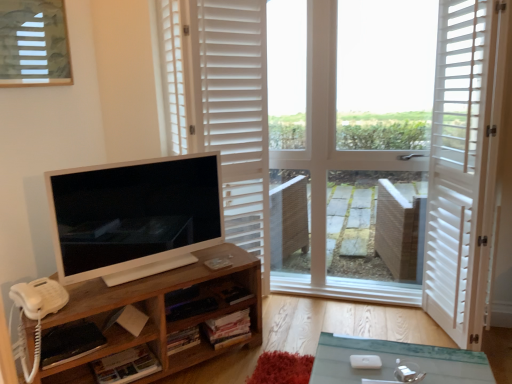
This screenshot has width=512, height=384. Describe the element at coordinates (135, 216) in the screenshot. I see `satin white monitor at left` at that location.

This screenshot has height=384, width=512. Describe the element at coordinates (456, 162) in the screenshot. I see `white wooden screen door at right` at that location.

Find the location of a particular element. The image size is (512, 384). satin white monitor at left is located at coordinates (135, 216).

Do you think satin white monitor at left is within matte glass window at upper left, or outside of it?

satin white monitor at left is located beyond the bounds of matte glass window at upper left.

In terms of height, does satin white monitor at left look taller or shorter compared to matte glass window at upper left?

Clearly, satin white monitor at left is taller compared to matte glass window at upper left.

From the image's perspective, is satin white monitor at left over matte glass window at upper left?

Actually, satin white monitor at left appears below matte glass window at upper left in the image.

Does point (217, 180) come behind point (32, 72)?

Yes.

Can you confirm if satin white monitor at left is thinner than white matte shutters at upper center?

Correct, the width of satin white monitor at left is less than that of white matte shutters at upper center.

From the image's perspective, is satin white monitor at left on top of white matte shutters at upper center?

No.

Is point (115, 241) closer to viewer compared to point (227, 78)?

Yes, it is in front of point (227, 78).

Locate an element on the screen. This screenshot has height=384, width=512. screen door on the right side of matte glass window at upper left is located at coordinates (456, 162).

How far apart are matte glass window at upper left and white wooden screen door at right?

They are 1.92 meters apart.

Is matte glass window at upper left positioned with its back to white wooden screen door at right?

No, matte glass window at upper left is not facing away from white wooden screen door at right.

Between white wooden screen door at right and matte glass window at upper left, which one has smaller width?

matte glass window at upper left is thinner.

Is white wooden screen door at right not close to matte glass window at upper left?

white wooden screen door at right is far away from matte glass window at upper left.

Looking at this image, can we say white wooden screen door at right lies outside matte glass window at upper left?

Yes.

How much distance is there between white wooden screen door at right and satin white monitor at left?

They are 1.31 meters apart.

Which is more to the right, white wooden screen door at right or satin white monitor at left?

white wooden screen door at right.

Would you say white wooden screen door at right contains satin white monitor at left?

No.

From a real-world perspective, who is located higher, white wooden screen door at right or satin white monitor at left?

In real-world perspective, white wooden screen door at right is above.

I want to click on computer monitor behind the white wooden screen door at right, so click(x=135, y=216).

Can you confirm if satin white monitor at left is positioned to the left of white wooden screen door at right?

Yes.

From the image's perspective, between satin white monitor at left and white wooden screen door at right, which one is located above?

white wooden screen door at right appears higher in the image.

Looking at this image, is white wooden screen door at right completely or partially inside white matte shutters at upper center?

That's incorrect, white wooden screen door at right is not inside white matte shutters at upper center.

From the picture: Considering the positions of objects white matte shutters at upper center and white wooden screen door at right in the image provided, who is more to the left, white matte shutters at upper center or white wooden screen door at right?

white matte shutters at upper center.

Who is smaller, white matte shutters at upper center or white wooden screen door at right?

white wooden screen door at right is smaller.

From the image's perspective, is white matte shutters at upper center on white wooden screen door at right?

Yes, from the image's perspective, white matte shutters at upper center is on top of white wooden screen door at right.

You are a GUI agent. You are given a task and a screenshot of the screen. Output one action in this format:
    pyautogui.click(x=<x>, y=<y>)
    Task: Click on the window lying above the satin white monitor at left (from the image's perspective)
    This screenshot has height=384, width=512.
    Given the screenshot: What is the action you would take?
    pyautogui.click(x=34, y=43)

Locate an element on the screen. curtain behind the satin white monitor at left is located at coordinates (221, 104).

When comparing their distances from white wooden screen door at right, does white matte shutters at upper center or satin white monitor at left seem further?

satin white monitor at left is positioned further to the anchor white wooden screen door at right.

Which object lies further to the anchor point white wooden screen door at right, woodenobject at left or satin white monitor at left?

satin white monitor at left is further to white wooden screen door at right.

Which object lies nearer to the anchor point white wooden screen door at right, white matte shutters at upper center or woodenobject at left?

Based on the image, white matte shutters at upper center appears to be nearer to white wooden screen door at right.

Considering their positions, is satin white monitor at left positioned closer to white wooden screen door at right than matte glass window at upper left?

Based on the image, satin white monitor at left appears to be nearer to white wooden screen door at right.

Which object lies nearer to the anchor point satin white monitor at left, woodenobject at left or white matte shutters at upper center?

woodenobject at left.

Estimate the real-world distances between objects in this image. Which object is closer to woodenobject at left, matte glass window at upper left or satin white monitor at left?

satin white monitor at left lies closer to woodenobject at left than the other object.

Based on their spatial positions, is woodenobject at left or white matte shutters at upper center further from white wooden screen door at right?

Among the two, woodenobject at left is located further to white wooden screen door at right.

Considering their positions, is woodenobject at left positioned further to white matte shutters at upper center than matte glass window at upper left?

woodenobject at left is positioned further to the anchor white matte shutters at upper center.

Where is `computer monitor between woodenobject at left and white wooden screen door at right`? computer monitor between woodenobject at left and white wooden screen door at right is located at coordinates (135, 216).

You are a GUI agent. You are given a task and a screenshot of the screen. Output one action in this format:
    pyautogui.click(x=<x>, y=<y>)
    Task: Click on the curtain that lies between matte glass window at upper left and satin white monitor at left from top to bottom
    
    Given the screenshot: What is the action you would take?
    pyautogui.click(x=221, y=104)

Identify the location of curtain situated between matte glass window at upper left and white wooden screen door at right from left to right. (221, 104).

Locate an element on the screen. This screenshot has width=512, height=384. shelf between matte glass window at upper left and white wooden screen door at right is located at coordinates (159, 313).